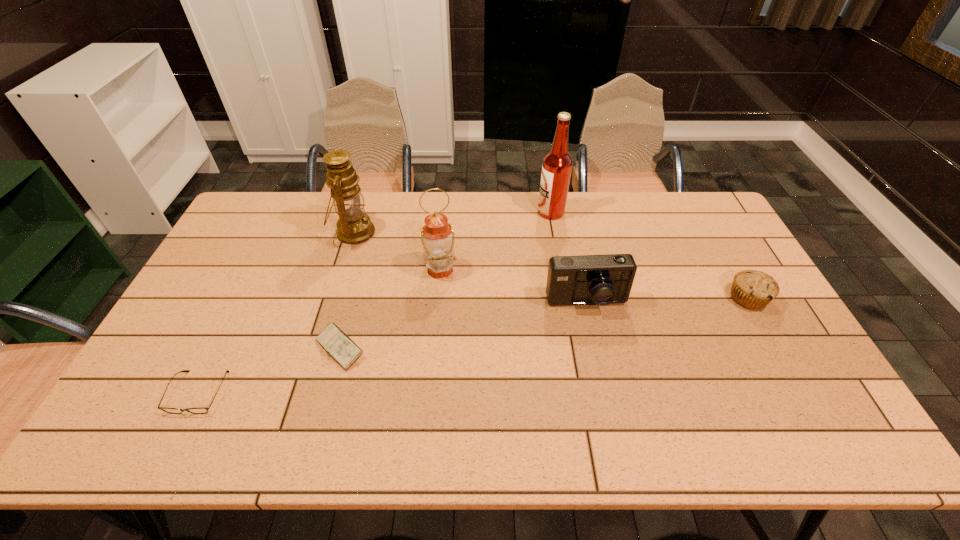
Image resolution: width=960 pixels, height=540 pixels. In order to click on vacant area situated 0.300m on the label side of the alcohol in this screenshot , I will do 454,212.

At what (x,y) coordinates should I click in order to perform the action: click on vacant area situated 0.400m on the label side of the alcohol. Please return your answer as a coordinate pair (x, y). Looking at the image, I should click on (426, 212).

At what (x,y) coordinates should I click in order to perform the action: click on vacant area situated 0.110m on the label side of the alcohol. Please return your answer as a coordinate pair (x, y). This screenshot has width=960, height=540. Looking at the image, I should click on (507, 212).

Find the location of `free space located 0.250m on the left of the left oil lamp`. free space located 0.250m on the left of the left oil lamp is located at coordinates (260, 232).

What are the coordinates of `vacant area situated on the left of the third farthest object` in the screenshot? It's located at (402, 270).

At what (x,y) coordinates should I click in order to perform the action: click on vacant space located 0.370m on the front-facing side of the camera. Please return your answer as a coordinate pair (x, y). The height and width of the screenshot is (540, 960). Looking at the image, I should click on (616, 444).

Find the location of a particular element. vacant space located on the left of the muffin is located at coordinates (694, 298).

The width and height of the screenshot is (960, 540). Find the location of `vacant space located 0.380m on the right of the second shortest object`. vacant space located 0.380m on the right of the second shortest object is located at coordinates (509, 348).

I want to click on alcohol located at the far edge, so click(x=557, y=165).

Where is `oil lamp that is at the far edge`? The image size is (960, 540). oil lamp that is at the far edge is located at coordinates [354, 227].